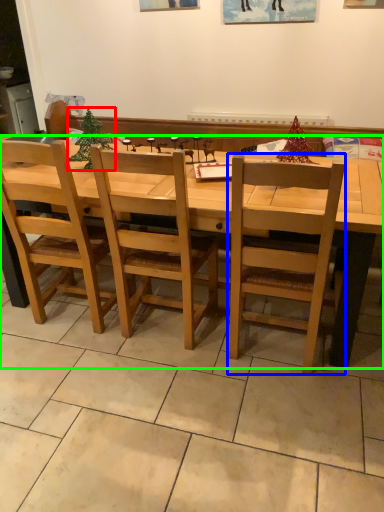
Question: Which object is positioned farthest from christmas tree (highlighted by a red box)? Select from chair (highlighted by a blue box) and desk (highlighted by a green box).

Choices:
 (A) chair
 (B) desk

Answer: (A)